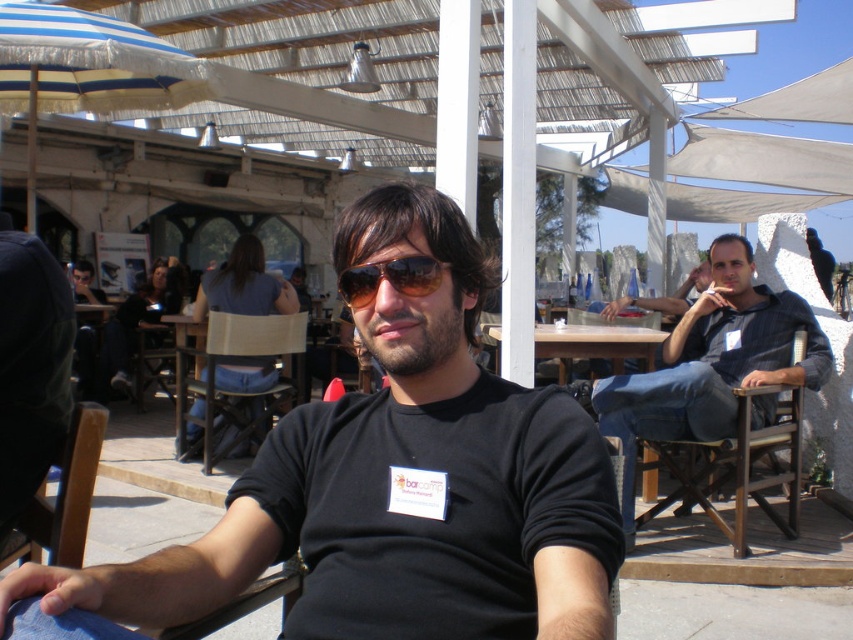
You are standing at the entrance of the outdoor cafe and want to move towards the two points marked in the image. Which point, point (642, 513) or point (245, 348), would you reach first?

Point (642, 513) is closer to the viewer than point (245, 348), so you would reach point (642, 513) first.

You are standing at the entrance of the outdoor cafe and want to locate two specific points marked on the floor. The first point is at coordinates point (233, 324) and the second is at point (554, 330). Which point is closer to you?

Point (233, 324) is closer to you because it is further to the viewer than point (554, 330).